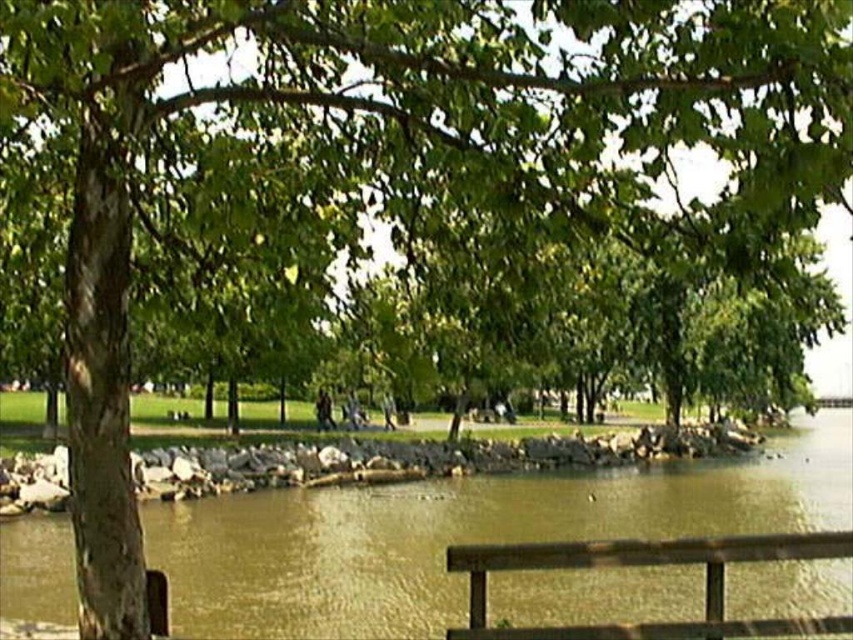
You are a photographer standing on the wooden railing in the scene. You want to take a photo of the brown sedimentary rock at center and the brown wooden bench at lower right. Which object should you focus on first if you want to capture both in a single shot without moving the camera?

You should focus on the brown sedimentary rock at center first because it is closer to the photographer than the brown wooden bench at lower right, allowing both to be in focus if the depth of field is sufficient.

You are standing at the edge of the wooden railing in the park scene. You see a brown sedimentary rock at center. Can you estimate its location in the image using coordinates?

The brown sedimentary rock at center is located at coordinates point (461, 534).